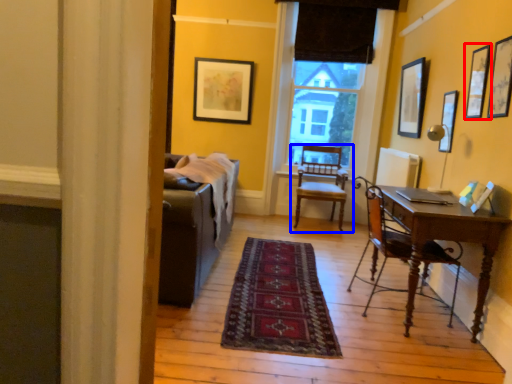
Question: Which object is closer to the camera taking this photo, picture frame (highlighted by a red box) or chair (highlighted by a blue box)?

Choices:
 (A) picture frame
 (B) chair

Answer: (A)